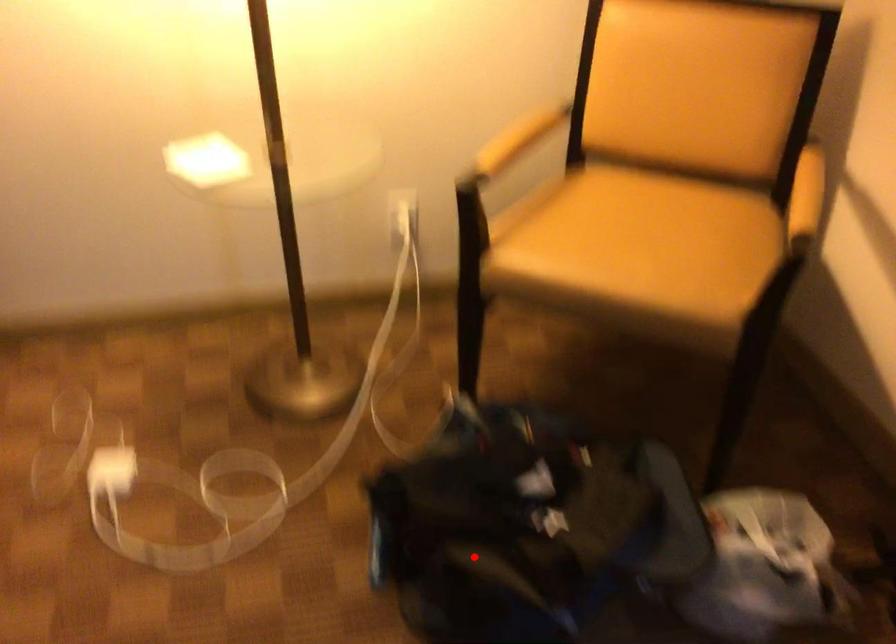
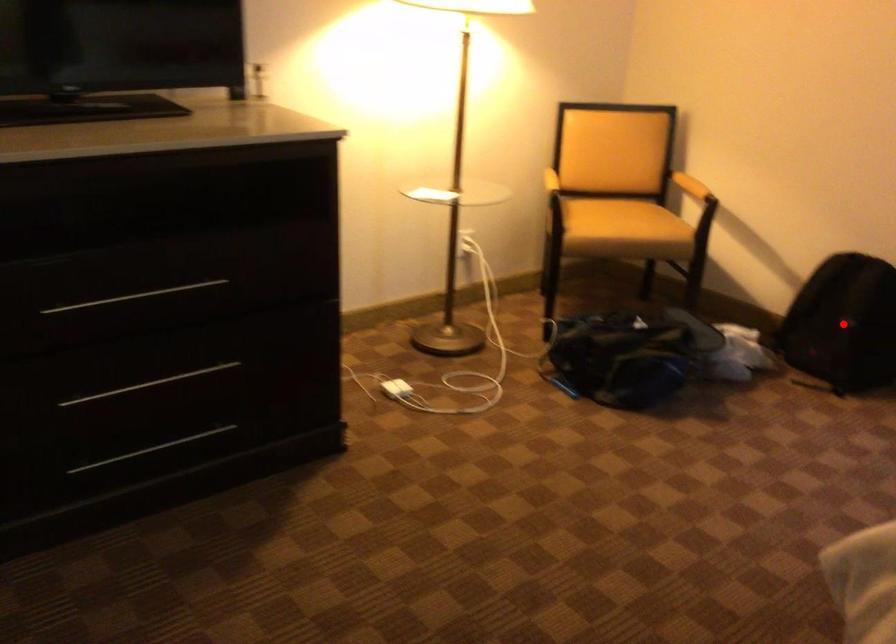
I am providing you with two images of the same scene from different viewpoints. A red point is marked on the first image and another point is marked on the second image. Does the point marked in image1 correspond to the same location as the one in image2?

No